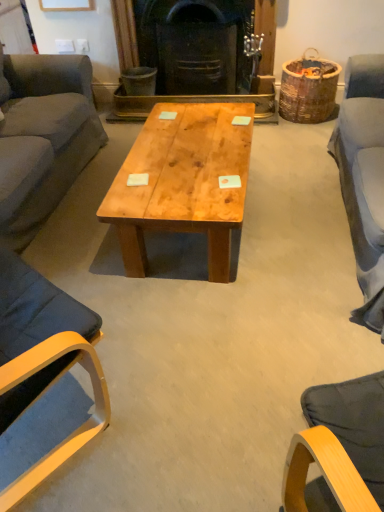
This screenshot has height=512, width=384. What are the coordinates of `free area in between natural wood coffee table at center and matte wood chair at left` in the screenshot? It's located at (127, 302).